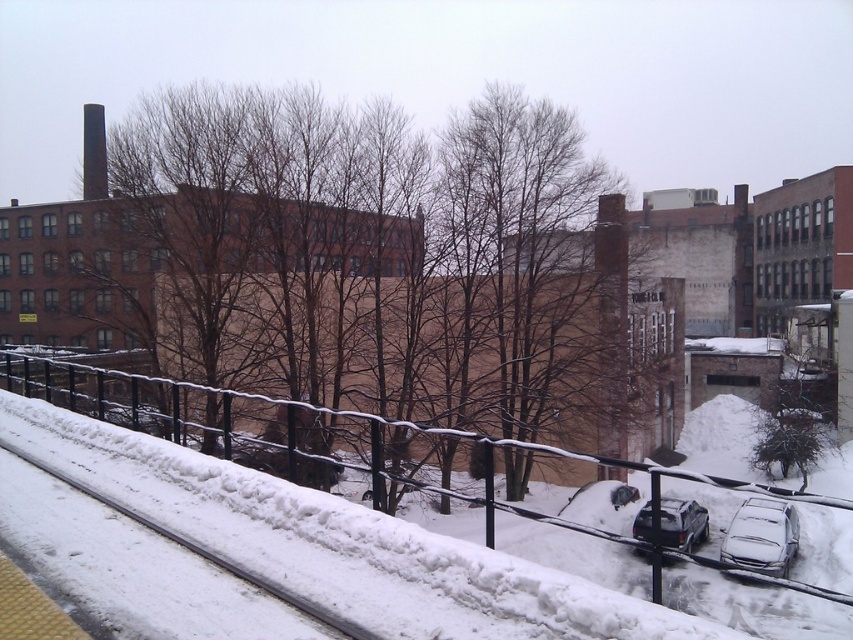
Question: Which point is closer to the camera?

Choices:
 (A) snow-covered metal train track at lower left
 (B) sleek silver sedan at lower right
 (C) brown leafless tree at center
 (D) satin black suv at lower right

Answer: (C)

Question: Estimate the real-world distances between objects in this image. Which object is farther from the brown leafless tree at center?

Choices:
 (A) snow-covered metal train track at lower left
 (B) sleek silver sedan at lower right
 (C) satin black suv at lower right

Answer: (A)

Question: Can you confirm if brown leafless tree at center is positioned above snow-covered metal train track at lower left?

Choices:
 (A) no
 (B) yes

Answer: (B)

Question: Among these objects, which one is nearest to the camera?

Choices:
 (A) brown leafless tree at center
 (B) sleek silver sedan at lower right

Answer: (A)

Question: Considering the relative positions of brown leafless tree at center and snow-covered metal train track at lower left in the image provided, where is brown leafless tree at center located with respect to snow-covered metal train track at lower left?

Choices:
 (A) below
 (B) above

Answer: (B)

Question: Can you confirm if sleek silver sedan at lower right is thinner than satin black suv at lower right?

Choices:
 (A) no
 (B) yes

Answer: (B)